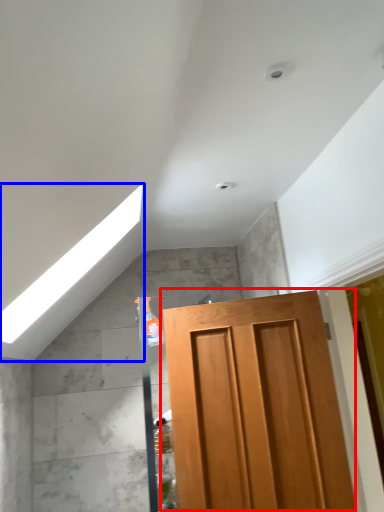
Question: Among these objects, which one is farthest to the camera, door (highlighted by a red box) or exhaust hood (highlighted by a blue box)?

Choices:
 (A) door
 (B) exhaust hood

Answer: (A)